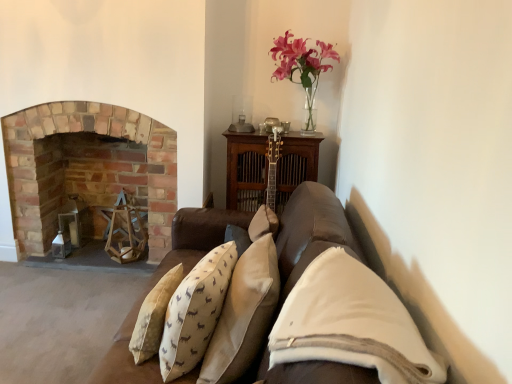
Question: Should I look upward or downward to see white soft pillow at center, which is the 1th pillow in right-to-left order?

Choices:
 (A) down
 (B) up

Answer: (A)

Question: Does white soft pillow at center, the third pillow viewed from the left, have a lesser height compared to brick fireplace at left?

Choices:
 (A) yes
 (B) no

Answer: (A)

Question: From a real-world perspective, is white soft pillow at center, which is the 1th pillow in right-to-left order, physically below brick fireplace at left?

Choices:
 (A) yes
 (B) no

Answer: (B)

Question: Does white soft pillow at center, the third pillow viewed from the left, lie behind brick fireplace at left?

Choices:
 (A) no
 (B) yes

Answer: (A)

Question: Can you confirm if white soft pillow at center, the third pillow viewed from the left, is smaller than brick fireplace at left?

Choices:
 (A) yes
 (B) no

Answer: (A)

Question: Does white soft pillow at center, which is the 1th pillow in right-to-left order, appear on the left side of brick fireplace at left?

Choices:
 (A) yes
 (B) no

Answer: (B)

Question: From the image's perspective, is white soft pillow at center, the third pillow viewed from the left, below brick fireplace at left?

Choices:
 (A) yes
 (B) no

Answer: (A)

Question: Is pink glass vase at upper center not near brick fireplace at left?

Choices:
 (A) yes
 (B) no

Answer: (A)

Question: Could you tell me if pink glass vase at upper center is turned towards brick fireplace at left?

Choices:
 (A) no
 (B) yes

Answer: (A)

Question: Can we say pink glass vase at upper center lies outside brick fireplace at left?

Choices:
 (A) no
 (B) yes

Answer: (B)

Question: Is pink glass vase at upper center thinner than brick fireplace at left?

Choices:
 (A) no
 (B) yes

Answer: (B)

Question: Is pink glass vase at upper center further to camera compared to brick fireplace at left?

Choices:
 (A) no
 (B) yes

Answer: (A)

Question: From the image's perspective, is pink glass vase at upper center above brick fireplace at left?

Choices:
 (A) yes
 (B) no

Answer: (A)

Question: Is brick fireplace at left oriented away from pink glass vase at upper center?

Choices:
 (A) yes
 (B) no

Answer: (B)